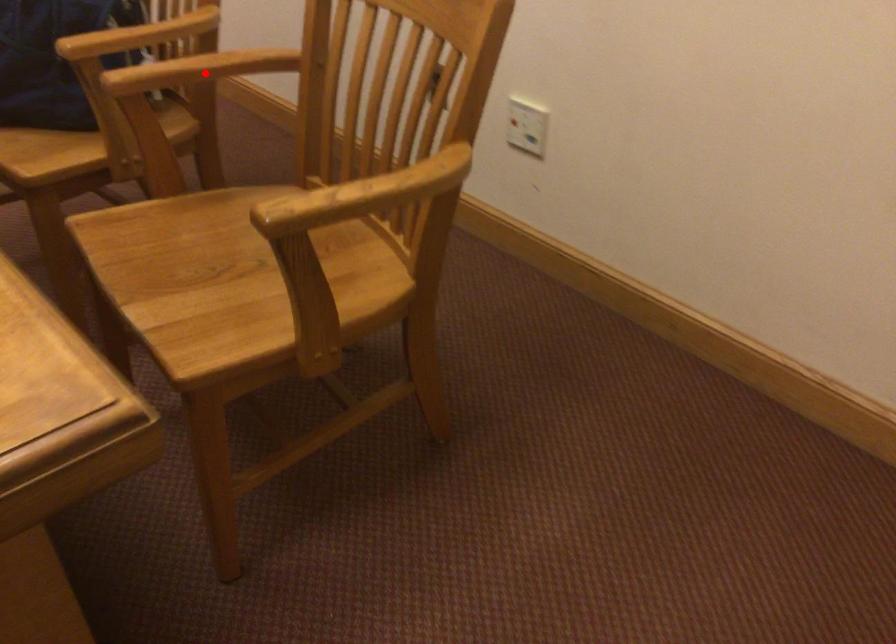
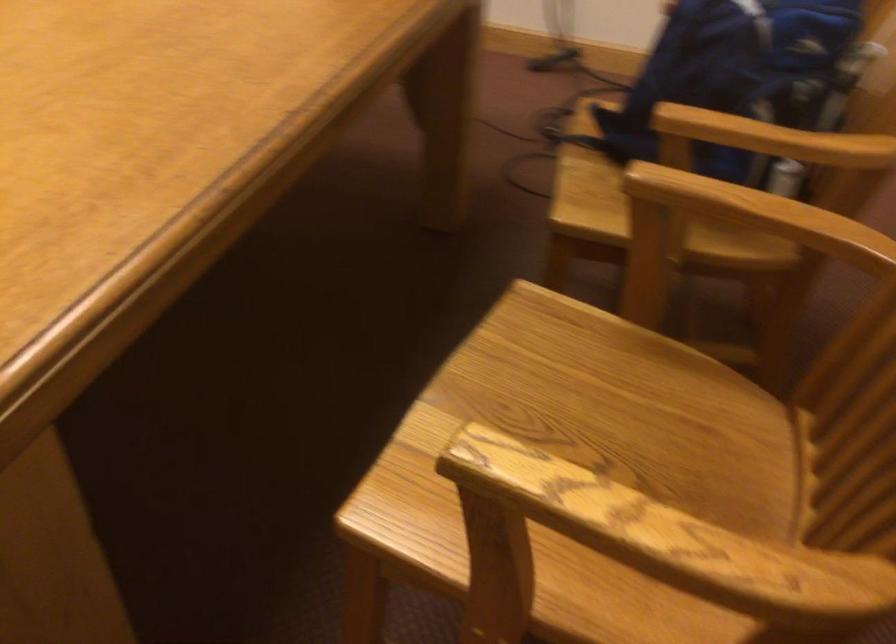
Question: I am providing you with two images of the same scene from different viewpoints. A red point is shown in image1. For the corresponding object point in image2, is it positioned nearer or farther from the camera?

Choices:
 (A) Nearer
 (B) Farther

Answer: (A)